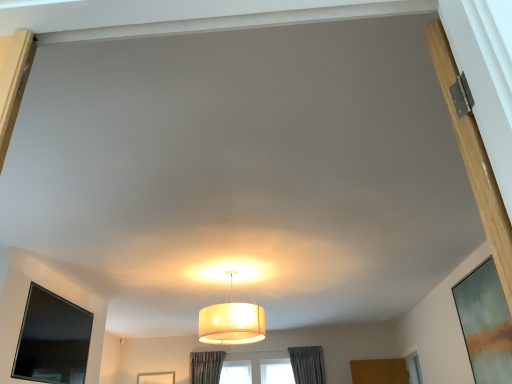
Question: Is matte glass window screen at right, the first window screen viewed from the right, completely or partially inside matte white lampshade at center?

Choices:
 (A) no
 (B) yes

Answer: (A)

Question: Does matte white lampshade at center have a greater width compared to matte glass window screen at right, arranged as the second window screen when viewed from the left?

Choices:
 (A) yes
 (B) no

Answer: (A)

Question: Can you confirm if matte white lampshade at center is smaller than matte glass window screen at right, arranged as the second window screen when viewed from the left?

Choices:
 (A) no
 (B) yes

Answer: (A)

Question: Considering the relative sizes of matte white lampshade at center and matte glass window screen at right, arranged as the second window screen when viewed from the left, in the image provided, is matte white lampshade at center bigger than matte glass window screen at right, arranged as the second window screen when viewed from the left,?

Choices:
 (A) yes
 (B) no

Answer: (A)

Question: From the image's perspective, does matte white lampshade at center appear lower than matte glass window screen at right, arranged as the second window screen when viewed from the left?

Choices:
 (A) yes
 (B) no

Answer: (B)

Question: Is point (474, 279) closer or farther from the camera than point (236, 319)?

Choices:
 (A) closer
 (B) farther

Answer: (B)

Question: From their relative heights in the image, would you say matte glass window screen at right, the first window screen viewed from the right, is taller or shorter than matte white lampshade at center?

Choices:
 (A) tall
 (B) short

Answer: (A)

Question: Is matte glass window screen at right, arranged as the second window screen when viewed from the left, wider or thinner than matte white lampshade at center?

Choices:
 (A) wide
 (B) thin

Answer: (B)

Question: In the image, is matte glass window screen at right, arranged as the second window screen when viewed from the left, positioned in front of or behind matte white lampshade at center?

Choices:
 (A) front
 (B) behind

Answer: (A)

Question: Is black glossy tv at lower left, the first window screen when ordered from left to right, wider or thinner than matte white lampshade at center?

Choices:
 (A) thin
 (B) wide

Answer: (A)

Question: Is black glossy tv at lower left, the first window screen when ordered from left to right, spatially inside matte white lampshade at center, or outside of it?

Choices:
 (A) inside
 (B) outside

Answer: (B)

Question: Is black glossy tv at lower left, the first window screen when ordered from left to right, bigger or smaller than matte white lampshade at center?

Choices:
 (A) big
 (B) small

Answer: (B)

Question: From a real-world perspective, is black glossy tv at lower left, which is the second window screen in right-to-left order, above or below matte white lampshade at center?

Choices:
 (A) above
 (B) below

Answer: (B)

Question: Is matte white lampshade at center wider or thinner than matte glass window screen at right, the first window screen viewed from the right?

Choices:
 (A) wide
 (B) thin

Answer: (A)

Question: Is matte white lampshade at center taller or shorter than matte glass window screen at right, the first window screen viewed from the right?

Choices:
 (A) short
 (B) tall

Answer: (A)